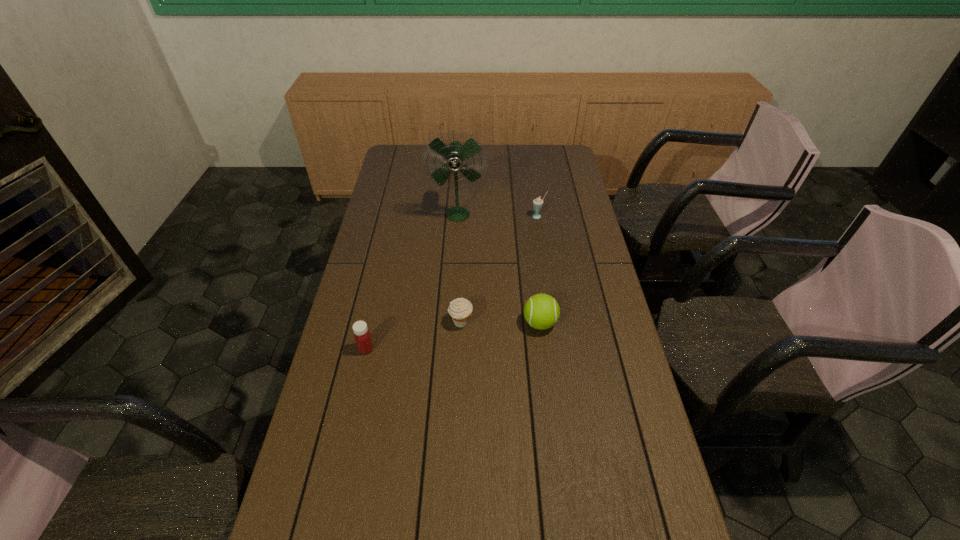
You are a GUI agent. You are given a task and a screenshot of the screen. Output one action in this format:
    pyautogui.click(x=<x>, y=<y>)
    Task: Click on the tallest object
    
    Given the screenshot: What is the action you would take?
    pyautogui.click(x=455, y=154)

This screenshot has width=960, height=540. I want to click on milkshake, so click(x=537, y=203).

The width and height of the screenshot is (960, 540). Identify the location of tennis ball. (541, 311).

What are the coordinates of `the leftmost object` in the screenshot? It's located at (362, 336).

Where is `the nearest object`? The image size is (960, 540). the nearest object is located at coordinates (362, 336).

Identify the location of muffin. (460, 310).

Locate an element on the screen. This screenshot has width=960, height=540. free space located on the front-facing side of the fan is located at coordinates (456, 242).

Find the location of a particular element. vacant space situated on the straw side of the milkshake is located at coordinates (x=547, y=275).

Find the location of a particular element. vacant space located 0.140m on the right of the tennis ball is located at coordinates (603, 323).

Find the location of a particular element. vacant point located on the right of the nearest object is located at coordinates (452, 349).